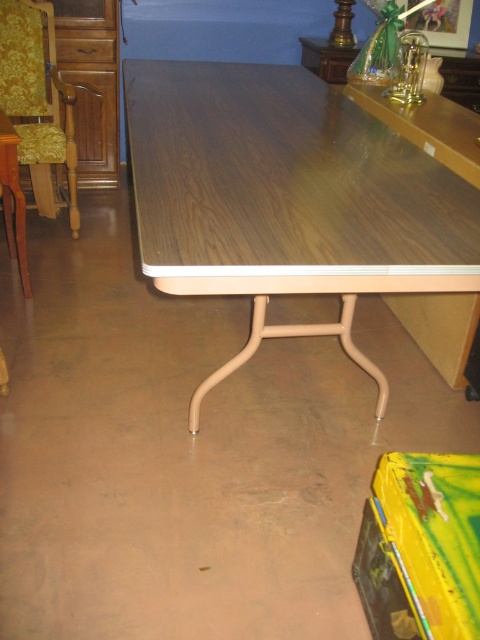
Question: Can you confirm if wooden table at center is positioned to the left of gold-patterned fabric armchair at upper left?

Choices:
 (A) yes
 (B) no

Answer: (B)

Question: Which point is farther to the camera?

Choices:
 (A) (24, 84)
 (B) (419, 195)

Answer: (A)

Question: Which object appears farthest from the camera in this image?

Choices:
 (A) gold-patterned fabric armchair at upper left
 (B) wooden table at center

Answer: (A)

Question: Is wooden table at center positioned at the back of gold-patterned fabric armchair at upper left?

Choices:
 (A) no
 (B) yes

Answer: (A)

Question: Is wooden table at center positioned behind gold-patterned fabric armchair at upper left?

Choices:
 (A) no
 (B) yes

Answer: (A)